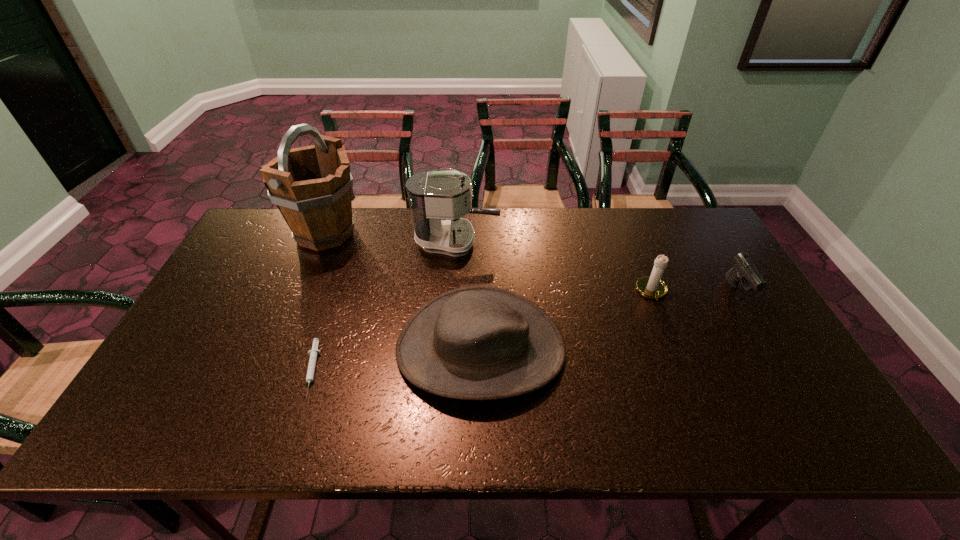
Identify the location of the tallest object. (311, 186).

Locate an element on the screen. coffee maker is located at coordinates (438, 199).

At what (x,y) coordinates should I click in order to perform the action: click on candle holder. Please return your answer as a coordinate pair (x, y). The width and height of the screenshot is (960, 540). Looking at the image, I should click on (652, 286).

Find the location of a particular element. The width and height of the screenshot is (960, 540). cowboy hat is located at coordinates (x=478, y=342).

I want to click on the rightmost object, so click(x=744, y=271).

The image size is (960, 540). Find the location of `pistol`. pistol is located at coordinates (744, 271).

Find the location of a particular element. The width and height of the screenshot is (960, 540). the shortest object is located at coordinates (313, 353).

Identify the location of vacant space located on the right of the bucket. This screenshot has height=540, width=960. (419, 233).

This screenshot has width=960, height=540. Identify the location of vacant area located on the front-facing side of the coffee maker. (590, 241).

Image resolution: width=960 pixels, height=540 pixels. What are the coordinates of `vacant space located on the handle side of the second object from right to left` in the screenshot? It's located at (673, 344).